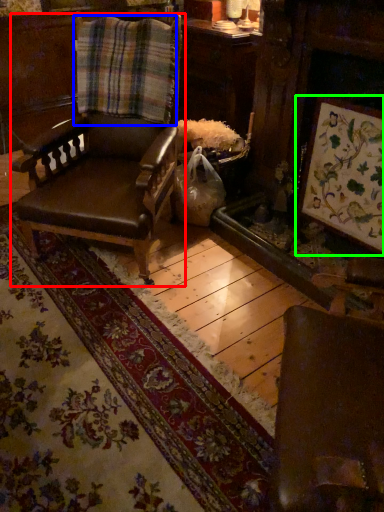
Question: Which is nearer to the chair (highlighted by a red box)? plaid (highlighted by a blue box) or picture frame (highlighted by a green box).

Choices:
 (A) plaid
 (B) picture frame

Answer: (A)